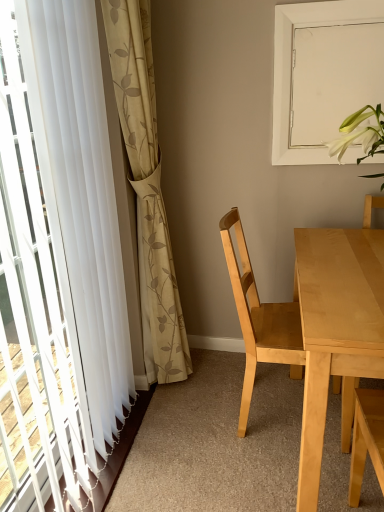
You are a GUI agent. You are given a task and a screenshot of the screen. Output one action in this format:
    pyautogui.click(x=<x>, y=<y>)
    Task: Click on the light wood chair at center
    
    Given the screenshot: What is the action you would take?
    pyautogui.click(x=259, y=319)

What do you see at coordinates (336, 332) in the screenshot? I see `light wood table at right` at bounding box center [336, 332].

This screenshot has width=384, height=512. Find the location of `white sheer curtain at left, the second curtain from the right`. white sheer curtain at left, the second curtain from the right is located at coordinates tap(37, 293).

Measure the distance between point (56, 208) and camera.

Point (56, 208) is 1.22 meters away from camera.

Locate an element on the screen. beige floral fabric curtain at left, positioned as the second curtain in left-to-right order is located at coordinates (147, 188).

Locate an element on the screen. This screenshot has width=384, height=512. light wood chair at center is located at coordinates (259, 319).

Based on the photo, from the image's perspective, which one is positioned lower, beige floral fabric curtain at left, positioned as the second curtain in left-to-right order, or white sheer curtain at left, the second curtain from the right?

white sheer curtain at left, the second curtain from the right.

Which of these two, beige floral fabric curtain at left, which appears as the first curtain when viewed from the right, or white sheer curtain at left, the 1th curtain in the left-to-right sequence, stands taller?

With more height is beige floral fabric curtain at left, which appears as the first curtain when viewed from the right.

How much distance is there between beige floral fabric curtain at left, positioned as the second curtain in left-to-right order, and white sheer curtain at left, the 1th curtain in the left-to-right sequence?

19.93 inches.

Is beige floral fabric curtain at left, which appears as the first curtain when viewed from the right, facing towards white sheer curtain at left, the second curtain from the right?

No, beige floral fabric curtain at left, which appears as the first curtain when viewed from the right, is not facing towards white sheer curtain at left, the second curtain from the right.

Consider the image. From a real-world perspective, is light wood chair at center positioned above or below white matte window screen at upper right?

light wood chair at center is situated lower than white matte window screen at upper right in the real world.

This screenshot has width=384, height=512. I want to click on window screen on the right side of light wood chair at center, so click(x=316, y=73).

Can you see light wood chair at center touching white matte window screen at upper right?

There is a gap between light wood chair at center and white matte window screen at upper right.

How many degrees apart are the facing directions of white sheer curtain at left, the second curtain from the right, and light wood table at right?

The angle between the facing direction of white sheer curtain at left, the second curtain from the right, and the facing direction of light wood table at right is 91.7 degrees.

From the image's perspective, which curtain is the 1st one above the light wood table at right? Please provide its 2D coordinates.

[(37, 293)]

From the image's perspective, relative to light wood table at right, is white sheer curtain at left, the second curtain from the right, above or below?

From the image's perspective, white sheer curtain at left, the second curtain from the right, appears above light wood table at right.

Is white sheer curtain at left, the second curtain from the right, thinner than light wood table at right?

Yes, white sheer curtain at left, the second curtain from the right, is thinner than light wood table at right.

Considering the positions of objects light wood table at right and white matte window screen at upper right in the image provided, who is more to the left, light wood table at right or white matte window screen at upper right?

Positioned to the left is white matte window screen at upper right.

Is point (353, 265) farther from camera compared to point (278, 21)?

No, (353, 265) is in front of (278, 21).

Identify the location of window screen above the light wood table at right (from the image's perspective). (316, 73).

From a real-world perspective, is light wood table at right below white matte window screen at upper right?

Yes, from a real-world perspective, light wood table at right is beneath white matte window screen at upper right.

Considering the sizes of light wood table at right and light wood chair at center in the image, is light wood table at right wider or thinner than light wood chair at center?

Considering their sizes, light wood table at right looks broader than light wood chair at center.

Is point (313, 301) positioned behind point (235, 208)?

That is False.

Based on the photo, from the image's perspective, between light wood table at right and light wood chair at center, which one is located above?

light wood chair at center.

Is light wood chair at center wider than white sheer curtain at left, the 1th curtain in the left-to-right sequence?

Yes, light wood chair at center is wider than white sheer curtain at left, the 1th curtain in the left-to-right sequence.

Which object is positioned more to the right, light wood chair at center or white sheer curtain at left, the 1th curtain in the left-to-right sequence?

Positioned to the right is light wood chair at center.

Does light wood chair at center have a lesser height compared to white sheer curtain at left, the 1th curtain in the left-to-right sequence?

Yes, light wood chair at center is shorter than white sheer curtain at left, the 1th curtain in the left-to-right sequence.

From the image's perspective, is light wood chair at center above or below white sheer curtain at left, the 1th curtain in the left-to-right sequence?

light wood chair at center is situated lower than white sheer curtain at left, the 1th curtain in the left-to-right sequence, in the image.

Can we say beige floral fabric curtain at left, positioned as the second curtain in left-to-right order, lies outside light wood table at right?

Yes, beige floral fabric curtain at left, positioned as the second curtain in left-to-right order, is located beyond the bounds of light wood table at right.

How many degrees apart are the facing directions of beige floral fabric curtain at left, which appears as the first curtain when viewed from the right, and light wood table at right?

The angle between the facing direction of beige floral fabric curtain at left, which appears as the first curtain when viewed from the right, and the facing direction of light wood table at right is 90.8 degrees.

From the picture: Is beige floral fabric curtain at left, which appears as the first curtain when viewed from the right, to the left of light wood table at right from the viewer's perspective?

Yes.

Which point is more forward, (143, 103) or (345, 345)?

The point (345, 345) is closer to the camera.

You are a GUI agent. You are given a task and a screenshot of the screen. Output one action in this format:
    pyautogui.click(x=<x>, y=<y>)
    Task: Click on the curtain on the right of the white sheer curtain at left, the 1th curtain in the left-to-right sequence
    The height and width of the screenshot is (512, 384).
    Given the screenshot: What is the action you would take?
    pyautogui.click(x=147, y=188)

Where is `window screen above the light wood chair at center (from a real-world perspective)`? The image size is (384, 512). window screen above the light wood chair at center (from a real-world perspective) is located at coordinates (316, 73).

Looking at the image, which one is located further to light wood table at right, beige floral fabric curtain at left, which appears as the first curtain when viewed from the right, or white sheer curtain at left, the 1th curtain in the left-to-right sequence?

Based on the image, white sheer curtain at left, the 1th curtain in the left-to-right sequence, appears to be further to light wood table at right.

From the image, which object appears to be farther from white sheer curtain at left, the 1th curtain in the left-to-right sequence, white matte window screen at upper right or beige floral fabric curtain at left, positioned as the second curtain in left-to-right order?

The object further to white sheer curtain at left, the 1th curtain in the left-to-right sequence, is white matte window screen at upper right.

Based on their spatial positions, is white matte window screen at upper right or light wood chair at center closer to white sheer curtain at left, the 1th curtain in the left-to-right sequence?

Based on the image, light wood chair at center appears to be nearer to white sheer curtain at left, the 1th curtain in the left-to-right sequence.

Looking at the image, which one is located closer to light wood chair at center, beige floral fabric curtain at left, positioned as the second curtain in left-to-right order, or white matte window screen at upper right?

The object closer to light wood chair at center is beige floral fabric curtain at left, positioned as the second curtain in left-to-right order.

Which object lies further to the anchor point light wood chair at center, white sheer curtain at left, the second curtain from the right, or beige floral fabric curtain at left, which appears as the first curtain when viewed from the right?

white sheer curtain at left, the second curtain from the right.

Estimate the real-world distances between objects in this image. Which object is closer to white sheer curtain at left, the second curtain from the right, beige floral fabric curtain at left, which appears as the first curtain when viewed from the right, or white matte window screen at upper right?

beige floral fabric curtain at left, which appears as the first curtain when viewed from the right, is positioned closer to the anchor white sheer curtain at left, the second curtain from the right.

Based on their spatial positions, is beige floral fabric curtain at left, positioned as the second curtain in left-to-right order, or white sheer curtain at left, the 1th curtain in the left-to-right sequence, further from light wood chair at center?

Based on the image, white sheer curtain at left, the 1th curtain in the left-to-right sequence, appears to be further to light wood chair at center.

From the image, which object appears to be nearer to light wood chair at center, white matte window screen at upper right or white sheer curtain at left, the second curtain from the right?

Among the two, white matte window screen at upper right is located nearer to light wood chair at center.

This screenshot has width=384, height=512. What are the coordinates of `curtain positioned between white sheer curtain at left, the 1th curtain in the left-to-right sequence, and light wood chair at center from near to far` in the screenshot? It's located at (147, 188).

This screenshot has height=512, width=384. What are the coordinates of `chair between white sheer curtain at left, the second curtain from the right, and light wood table at right from left to right` in the screenshot? It's located at (259, 319).

Locate an element on the screen. The height and width of the screenshot is (512, 384). curtain between white sheer curtain at left, the 1th curtain in the left-to-right sequence, and white matte window screen at upper right in the front-back direction is located at coordinates (147, 188).

The width and height of the screenshot is (384, 512). Find the location of `curtain between white sheer curtain at left, the second curtain from the right, and light wood table at right`. curtain between white sheer curtain at left, the second curtain from the right, and light wood table at right is located at coordinates (147, 188).